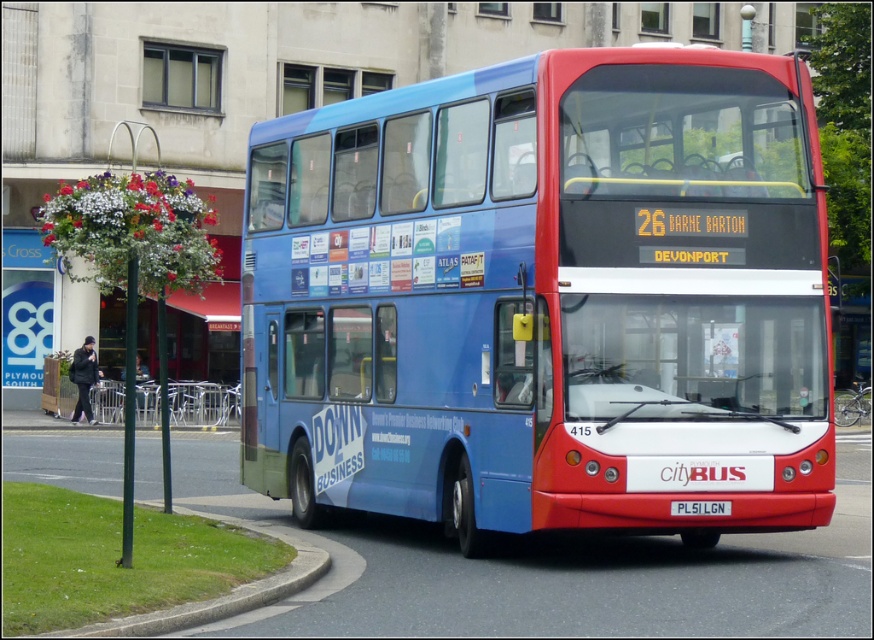
Question: Can you confirm if blue matte bus at center is positioned to the right of white plastic license plate at center?

Choices:
 (A) no
 (B) yes

Answer: (A)

Question: Among these points, which one is nearest to the camera?

Choices:
 (A) (712, 509)
 (B) (559, 273)

Answer: (B)

Question: Among these points, which one is nearest to the camera?

Choices:
 (A) (699, 509)
 (B) (792, 337)

Answer: (A)

Question: Among these objects, which one is farthest from the camera?

Choices:
 (A) white plastic license plate at center
 (B) blue matte bus at center

Answer: (B)

Question: Does blue matte bus at center lie in front of white plastic license plate at center?

Choices:
 (A) no
 (B) yes

Answer: (A)

Question: Does blue matte bus at center appear on the left side of white plastic license plate at center?

Choices:
 (A) no
 (B) yes

Answer: (B)